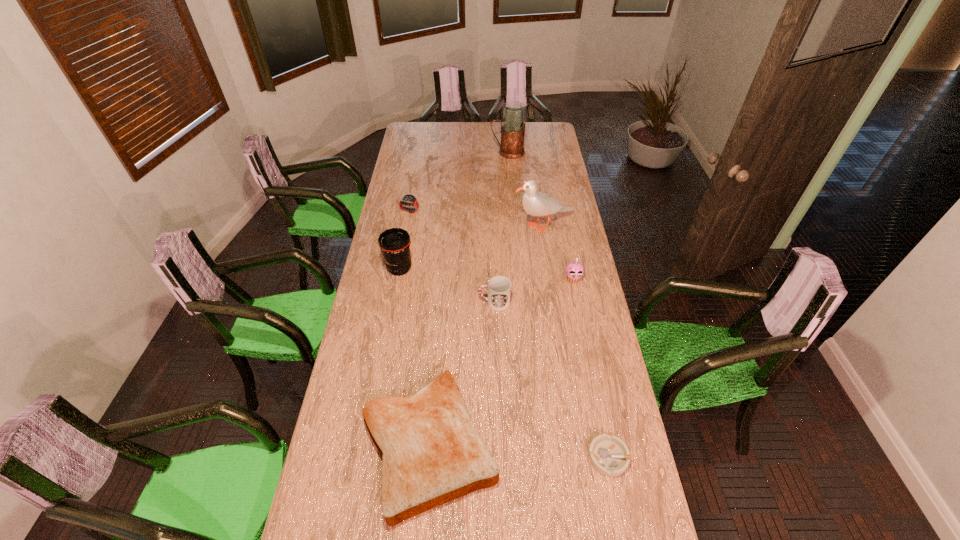
This screenshot has width=960, height=540. In order to click on free space located 0.310m on the back of the seventh nearest object in this screenshot , I will do `click(417, 172)`.

Find the location of a particular element. vacant area situated on the back of the bread is located at coordinates (442, 294).

Where is `vacant region located 0.350m on the left of the shortest object`? vacant region located 0.350m on the left of the shortest object is located at coordinates (471, 457).

Identify the location of telephoto lens that is at the left edge. The height and width of the screenshot is (540, 960). (394, 243).

Image resolution: width=960 pixels, height=540 pixels. In order to click on watch situated at the left edge in this screenshot , I will do `click(409, 200)`.

Find the location of `bread present at the left edge`. bread present at the left edge is located at coordinates (431, 452).

The width and height of the screenshot is (960, 540). In order to click on gull located at the right edge in this screenshot , I will do `click(535, 203)`.

Image resolution: width=960 pixels, height=540 pixels. Find the location of `cupcake located at the right edge`. cupcake located at the right edge is located at coordinates (575, 269).

Where is `ashtray that is at the right edge`? This screenshot has width=960, height=540. ashtray that is at the right edge is located at coordinates (609, 455).

This screenshot has height=540, width=960. I want to click on free spot at the left edge of the desktop, so click(405, 168).